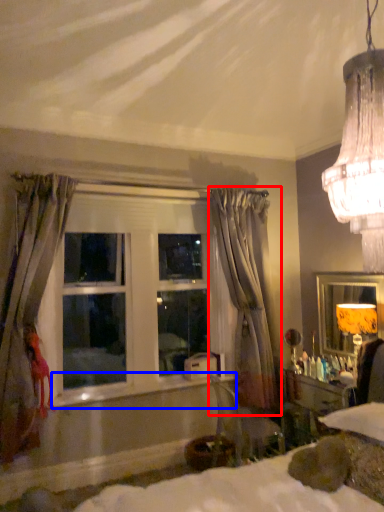
Question: Among these objects, which one is farthest to the camera, curtain (highlighted by a red box) or window sill (highlighted by a blue box)?

Choices:
 (A) curtain
 (B) window sill

Answer: (A)